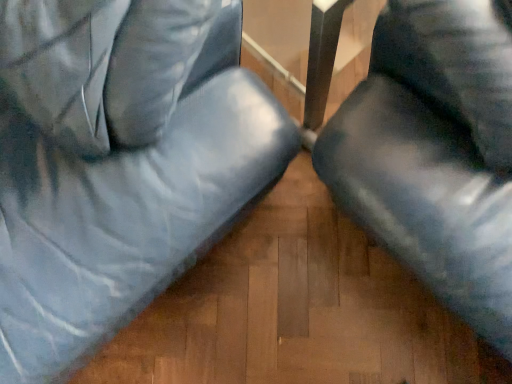
Locate an element on the screen. Image resolution: width=512 pixels, height=384 pixels. matte plastic chair at center is located at coordinates (118, 163).

Image resolution: width=512 pixels, height=384 pixels. Describe the element at coordinates (118, 163) in the screenshot. I see `matte plastic chair at center` at that location.

I want to click on matte plastic chair at center, so click(x=118, y=163).